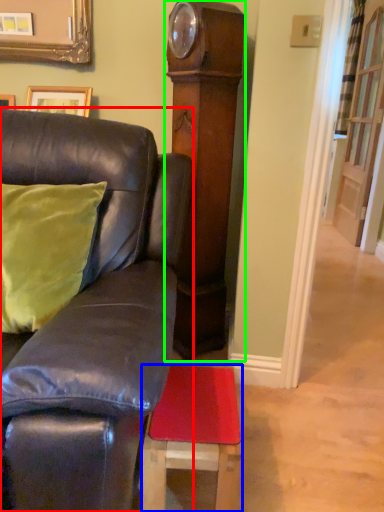
Question: Which object is positioned farthest from furniture (highlighted by a red box)? Select from stool (highlighted by a blue box) and side (highlighted by a green box).

Choices:
 (A) stool
 (B) side

Answer: (B)